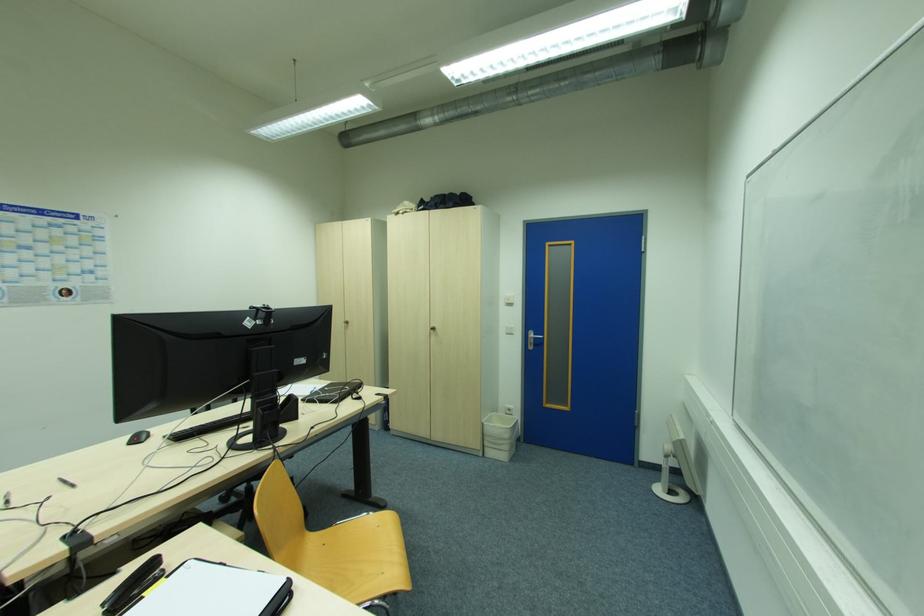
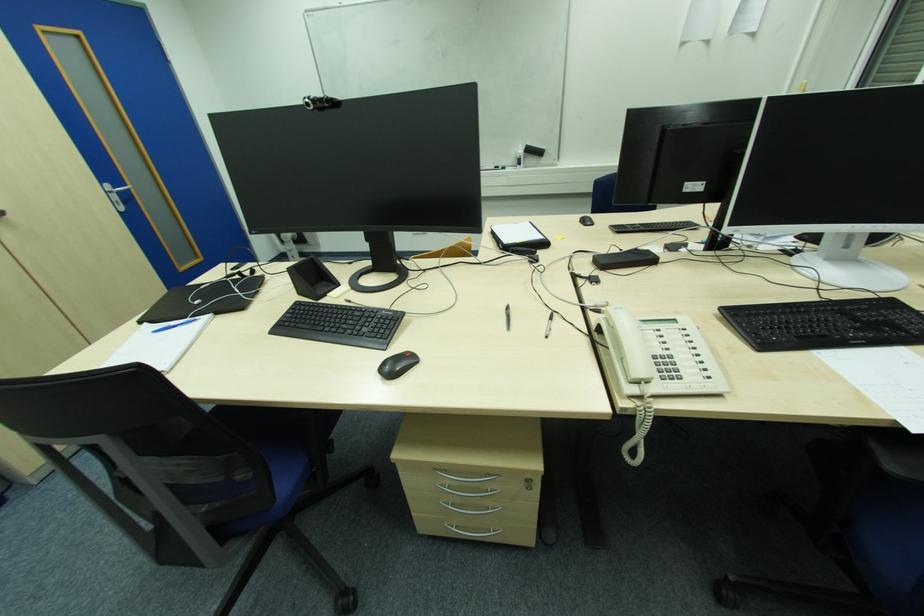
The point at (532, 345) is marked in the first image. Where is the corresponding point in the second image?

(119, 204)